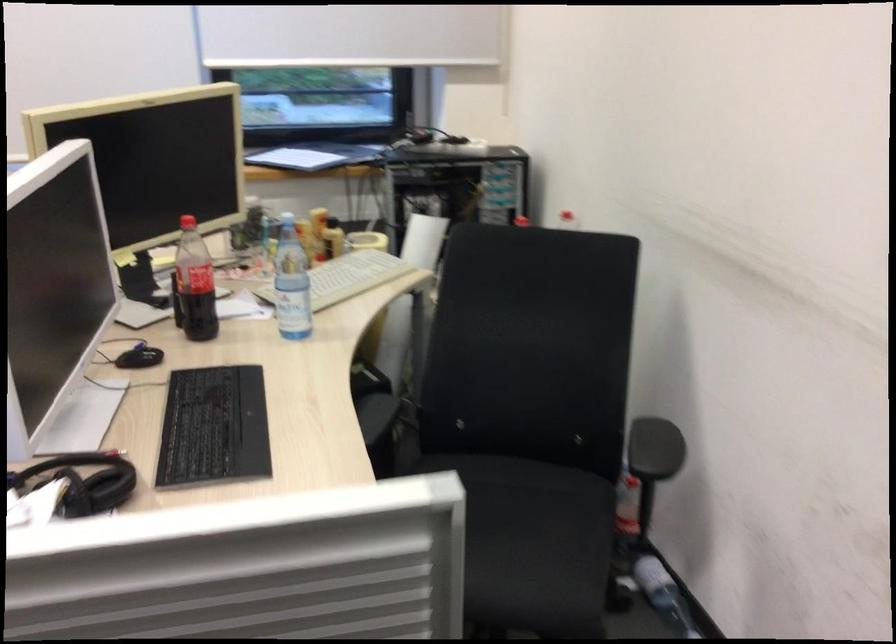
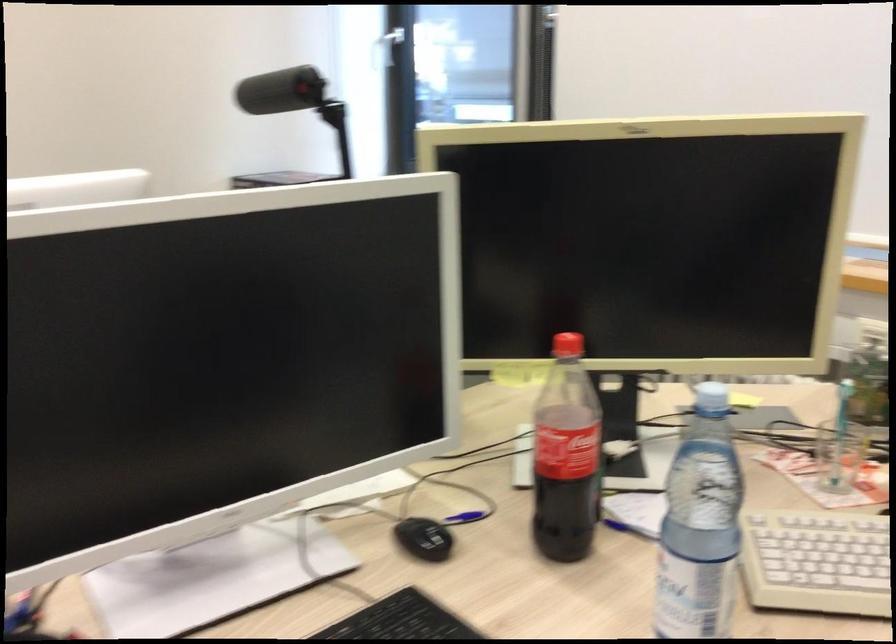
Find the pixel in the second image that matches the point at 257,259 in the first image.

(839, 456)